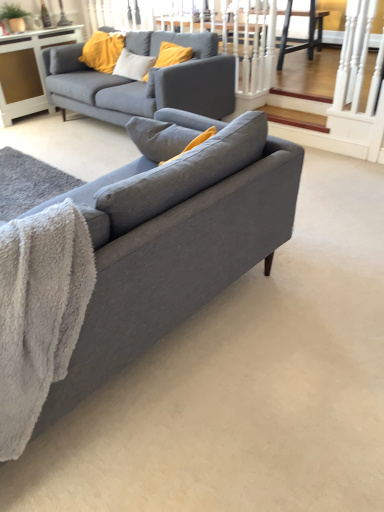
Identify the location of white glossy cabinet at upper left. The height and width of the screenshot is (512, 384). (28, 70).

In order to face matte gray couch at center, which is the second studio couch in top-to-bottom order, should I rotate leftwards or rightwards?

Rotate your view left by about 11.277°.

How much space does matte gray couch at center, which is counted as the 2th studio couch, starting from the front, occupy vertically?

matte gray couch at center, which is counted as the 2th studio couch, starting from the front, is 34.49 inches tall.

Identify the location of gray fluffy blanket at lower left. The height and width of the screenshot is (512, 384). (39, 312).

What do you see at coordinates (39, 312) in the screenshot? I see `gray fluffy blanket at lower left` at bounding box center [39, 312].

Locate an element on the screen. This screenshot has width=384, height=512. white glossy cabinet at upper left is located at coordinates (28, 70).

Are matte gray couch at center, the 2th studio couch positioned from the back, and gray fluffy blanket at lower left far apart?

No, matte gray couch at center, the 2th studio couch positioned from the back, is not far away from gray fluffy blanket at lower left.

Between matte gray couch at center, the 2th studio couch positioned from the back, and gray fluffy blanket at lower left, which one has larger width?

matte gray couch at center, the 2th studio couch positioned from the back.

From a real-world perspective, is matte gray couch at center, arranged as the first studio couch when ordered from the bottom, positioned over gray fluffy blanket at lower left based on gravity?

No, from a real-world perspective, matte gray couch at center, arranged as the first studio couch when ordered from the bottom, is not over gray fluffy blanket at lower left

Which is in front, point (126, 292) or point (16, 434)?

The point (16, 434) is in front.

From a real-world perspective, which is physically above, white glossy cabinet at upper left or matte gray couch at center, which appears as the 2th studio couch when ordered from the bottom?

matte gray couch at center, which appears as the 2th studio couch when ordered from the bottom.

How many degrees apart are the facing directions of white glossy cabinet at upper left and matte gray couch at center, which is counted as the 2th studio couch, starting from the front?

The angular difference between white glossy cabinet at upper left and matte gray couch at center, which is counted as the 2th studio couch, starting from the front, is 90 degrees.

Who is shorter, white glossy cabinet at upper left or matte gray couch at center, which appears as the 2th studio couch when ordered from the bottom?

white glossy cabinet at upper left is shorter.

Does white glossy cabinet at upper left come behind matte gray couch at center, which appears as the 2th studio couch when ordered from the bottom?

Yes, it is.

Does matte gray couch at center, the first studio couch in the front-to-back sequence, come behind matte gray couch at center, the 1th studio couch when ordered from back to front?

That is False.

Between matte gray couch at center, the 2th studio couch positioned from the back, and matte gray couch at center, which appears as the 2th studio couch when ordered from the bottom, which one appears on the left side from the viewer's perspective?

matte gray couch at center, which appears as the 2th studio couch when ordered from the bottom, is more to the left.

Would you consider matte gray couch at center, arranged as the first studio couch when ordered from the bottom, to be distant from matte gray couch at center, the 1th studio couch when ordered from back to front?

matte gray couch at center, arranged as the first studio couch when ordered from the bottom, is positioned a significant distance from matte gray couch at center, the 1th studio couch when ordered from back to front.

Who is shorter, matte gray couch at center, which is counted as the 2th studio couch, starting from the front, or gray fluffy blanket at lower left?

gray fluffy blanket at lower left is shorter.

From the picture: From a real-world perspective, which is physically above, matte gray couch at center, the 1th studio couch when ordered from back to front, or gray fluffy blanket at lower left?

From a 3D spatial view, gray fluffy blanket at lower left is above.

In the scene shown: Is matte gray couch at center, which appears as the 2th studio couch when ordered from the bottom, looking in the opposite direction of gray fluffy blanket at lower left?

That's not correct — matte gray couch at center, which appears as the 2th studio couch when ordered from the bottom, is not looking away from gray fluffy blanket at lower left.

The height and width of the screenshot is (512, 384). What are the coordinates of `blanket that appears above the matte gray couch at center, which appears as the 2th studio couch when ordered from the bottom (from a real-world perspective)` in the screenshot? It's located at (39, 312).

Could you tell me if matte gray couch at center, which is counted as the 2th studio couch, starting from the front, is facing white glossy cabinet at upper left?

No, matte gray couch at center, which is counted as the 2th studio couch, starting from the front, is not aimed at white glossy cabinet at upper left.

Can you confirm if matte gray couch at center, which appears as the 2th studio couch when ordered from the bottom, is thinner than white glossy cabinet at upper left?

No, matte gray couch at center, which appears as the 2th studio couch when ordered from the bottom, is not thinner than white glossy cabinet at upper left.

How far apart are matte gray couch at center, which is counted as the 2th studio couch, starting from the front, and white glossy cabinet at upper left?

matte gray couch at center, which is counted as the 2th studio couch, starting from the front, is 29.85 inches from white glossy cabinet at upper left.

Considering the points (35, 416) and (220, 115), which point is in front, point (35, 416) or point (220, 115)?

Point (35, 416)

Find the location of a particular element. The height and width of the screenshot is (512, 384). blanket that appears on the left of matte gray couch at center, which appears as the 2th studio couch when ordered from the bottom is located at coordinates (39, 312).

Considering the sizes of objects gray fluffy blanket at lower left and matte gray couch at center, the 1th studio couch when ordered from back to front, in the image provided, who is bigger, gray fluffy blanket at lower left or matte gray couch at center, the 1th studio couch when ordered from back to front,?

Bigger between the two is matte gray couch at center, the 1th studio couch when ordered from back to front.

Is gray fluffy blanket at lower left situated inside matte gray couch at center, the first studio couch from the top, or outside?

gray fluffy blanket at lower left is spatially situated outside matte gray couch at center, the first studio couch from the top.

From a real-world perspective, is white glossy cabinet at upper left below matte gray couch at center, which is the second studio couch in top-to-bottom order?

Yes, from a real-world perspective, white glossy cabinet at upper left is below matte gray couch at center, which is the second studio couch in top-to-bottom order.

In terms of height, does white glossy cabinet at upper left look taller or shorter compared to matte gray couch at center, which is the second studio couch in top-to-bottom order?

In the image, white glossy cabinet at upper left appears to be shorter than matte gray couch at center, which is the second studio couch in top-to-bottom order.

Is there a large distance between white glossy cabinet at upper left and matte gray couch at center, the first studio couch in the front-to-back sequence?

Absolutely, white glossy cabinet at upper left is distant from matte gray couch at center, the first studio couch in the front-to-back sequence.

Where is `blanket above the matte gray couch at center, which is the second studio couch in top-to-bottom order (from a real-world perspective)`? This screenshot has width=384, height=512. blanket above the matte gray couch at center, which is the second studio couch in top-to-bottom order (from a real-world perspective) is located at coordinates (39, 312).

At what (x,y) coordinates should I click in order to perform the action: click on studio couch that is the 1st one when counting rightward from the white glossy cabinet at upper left. Please return your answer as a coordinate pair (x, y). Looking at the image, I should click on (145, 83).

Looking at the image, which one is located closer to white glossy cabinet at upper left, gray fluffy blanket at lower left or matte gray couch at center, which is counted as the 2th studio couch, starting from the front?

The object closer to white glossy cabinet at upper left is matte gray couch at center, which is counted as the 2th studio couch, starting from the front.

Estimate the real-world distances between objects in this image. Which object is further from white glossy cabinet at upper left, matte gray couch at center, arranged as the first studio couch when ordered from the bottom, or gray fluffy blanket at lower left?

Among the two, gray fluffy blanket at lower left is located further to white glossy cabinet at upper left.

Based on the photo, considering their positions, is matte gray couch at center, which is the second studio couch in top-to-bottom order, positioned closer to white glossy cabinet at upper left than matte gray couch at center, which appears as the 2th studio couch when ordered from the bottom?

The object closer to white glossy cabinet at upper left is matte gray couch at center, which appears as the 2th studio couch when ordered from the bottom.

When comparing their distances from gray fluffy blanket at lower left, does matte gray couch at center, which is counted as the 2th studio couch, starting from the front, or matte gray couch at center, the first studio couch in the front-to-back sequence, seem further?

Based on the image, matte gray couch at center, which is counted as the 2th studio couch, starting from the front, appears to be further to gray fluffy blanket at lower left.

When comparing their distances from gray fluffy blanket at lower left, does matte gray couch at center, the 2th studio couch positioned from the back, or white glossy cabinet at upper left seem closer?

matte gray couch at center, the 2th studio couch positioned from the back.

Looking at the image, which one is located closer to gray fluffy blanket at lower left, matte gray couch at center, which is the second studio couch in top-to-bottom order, or matte gray couch at center, which appears as the 2th studio couch when ordered from the bottom?

The object closer to gray fluffy blanket at lower left is matte gray couch at center, which is the second studio couch in top-to-bottom order.

Looking at this image, when comparing their distances from gray fluffy blanket at lower left, does white glossy cabinet at upper left or matte gray couch at center, the 2th studio couch positioned from the back, seem closer?

matte gray couch at center, the 2th studio couch positioned from the back, lies closer to gray fluffy blanket at lower left than the other object.

Considering their positions, is gray fluffy blanket at lower left positioned closer to matte gray couch at center, arranged as the first studio couch when ordered from the bottom, than matte gray couch at center, which appears as the 2th studio couch when ordered from the bottom?

gray fluffy blanket at lower left is closer to matte gray couch at center, arranged as the first studio couch when ordered from the bottom.

I want to click on studio couch positioned between gray fluffy blanket at lower left and white glossy cabinet at upper left from near to far, so click(145, 83).

I want to click on blanket located between matte gray couch at center, arranged as the first studio couch when ordered from the bottom, and matte gray couch at center, the 1th studio couch when ordered from back to front, in the depth direction, so click(39, 312).

Locate an element on the screen. blanket between matte gray couch at center, which is the second studio couch in top-to-bottom order, and white glossy cabinet at upper left, along the z-axis is located at coordinates [39, 312].

The width and height of the screenshot is (384, 512). Identify the location of studio couch located between matte gray couch at center, which is the second studio couch in top-to-bottom order, and white glossy cabinet at upper left in the depth direction. (145, 83).